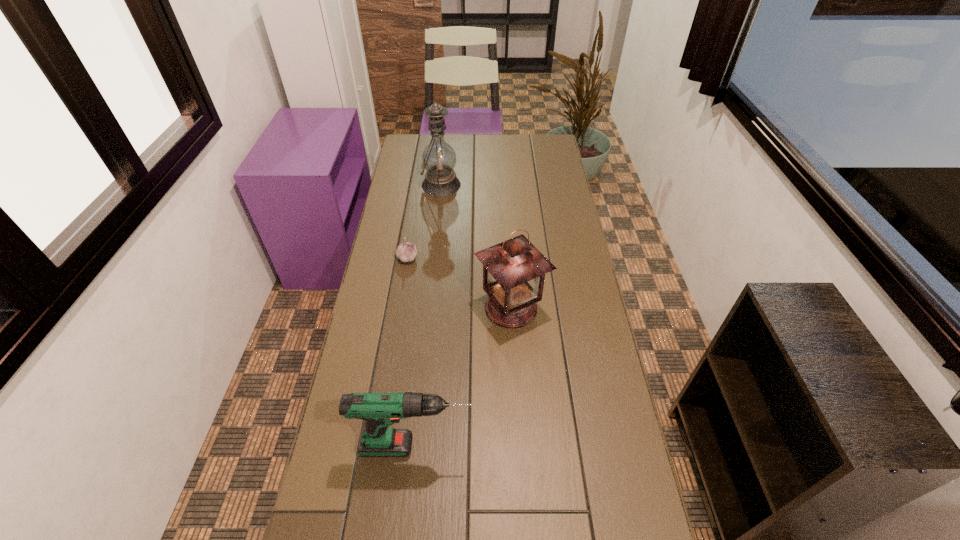
This screenshot has width=960, height=540. I want to click on free space located 0.200m on the handle side of the drill, so click(554, 447).

The image size is (960, 540). Find the location of `free spot located on the front of the shortest object`. free spot located on the front of the shortest object is located at coordinates (398, 309).

Identify the location of oil lamp that is at the left edge. (439, 158).

Where is `drill located at the left edge`? drill located at the left edge is located at coordinates (379, 410).

At what (x,y) coordinates should I click in order to perform the action: click on garlic located at the left edge. Please return your answer as a coordinate pair (x, y). This screenshot has height=540, width=960. Looking at the image, I should click on (406, 252).

You are a GUI agent. You are given a task and a screenshot of the screen. Output one action in this format:
    pyautogui.click(x=<x>, y=<y>)
    Task: Click on the object that is at the right edge
    The height and width of the screenshot is (540, 960).
    Given the screenshot: What is the action you would take?
    pyautogui.click(x=514, y=271)

What are the coordinates of `vacant point at the far edge` in the screenshot? It's located at (462, 141).

The width and height of the screenshot is (960, 540). Find the location of `blank space at the left edge`. blank space at the left edge is located at coordinates (402, 191).

Find the location of `vacant space at the right edge of the desktop`. vacant space at the right edge of the desktop is located at coordinates (597, 492).

Find the location of a particular element. The width and height of the screenshot is (960, 540). vacant space at the far right corner of the desktop is located at coordinates (532, 141).